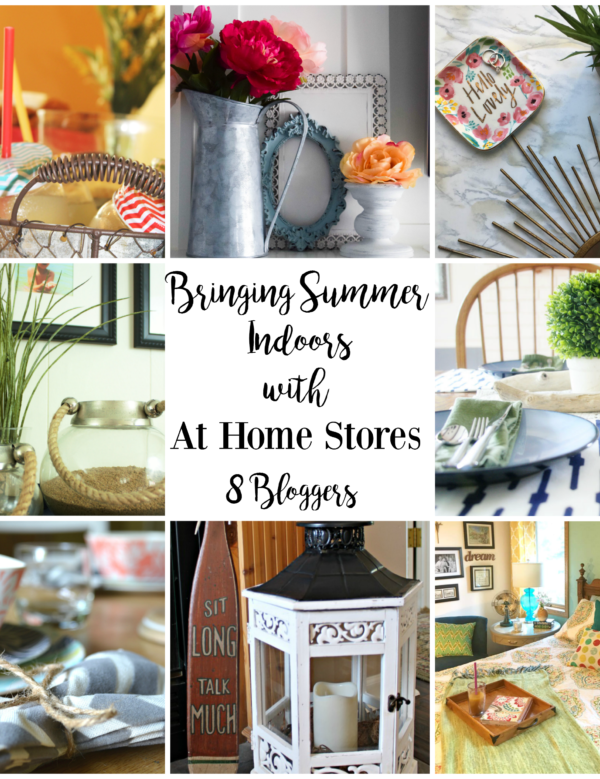
You are a GUI agent. You are given a task and a screenshot of the screen. Output one action in this format:
    pyautogui.click(x=<x>, y=<y>)
    Task: Click on the metallic pitcher
    This screenshot has height=779, width=600.
    Given the screenshot: What is the action you would take?
    pyautogui.click(x=222, y=185)